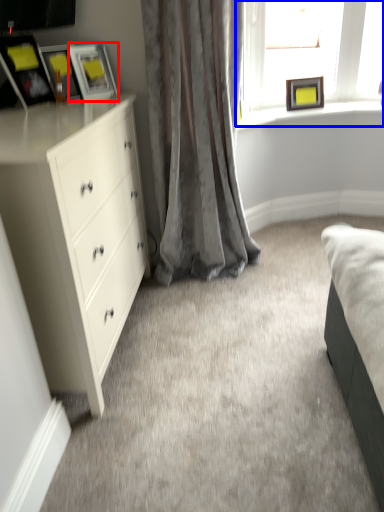
Question: Which object is further to the camera taking this photo, picture frame (highlighted by a red box) or window (highlighted by a blue box)?

Choices:
 (A) picture frame
 (B) window

Answer: (B)